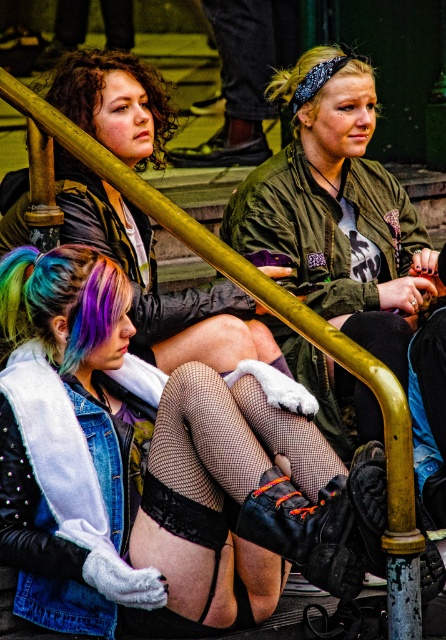
Between denim vest at center and fishnet stockings at center, which one appears on the left side from the viewer's perspective?

denim vest at center

Looking at this image, how much distance is there between denim vest at center and fishnet stockings at center?

They are 4.45 meters apart.

Is point (3, 458) more distant than point (209, 476)?

Yes, point (3, 458) is farther from viewer.

In order to click on denim vest at center in this screenshot , I will do `click(61, 440)`.

Which of these two, denim vest at center or suede boot at lower center, stands shorter?

suede boot at lower center is shorter.

Can you confirm if denim vest at center is positioned to the left of suede boot at lower center?

Correct, you'll find denim vest at center to the left of suede boot at lower center.

What do you see at coordinates (61, 440) in the screenshot?
I see `denim vest at center` at bounding box center [61, 440].

Where is `denim vest at center`? The image size is (446, 640). denim vest at center is located at coordinates (61, 440).

Does rainbow dyed hair at lower left have a lesser width compared to suede boot at lower center?

In fact, rainbow dyed hair at lower left might be wider than suede boot at lower center.

Between point (79, 301) and point (298, 506), which one is positioned behind?

The point (79, 301) is behind.

This screenshot has width=446, height=640. What are the coordinates of `rainbow dyed hair at lower left` in the screenshot? It's located at (61, 298).